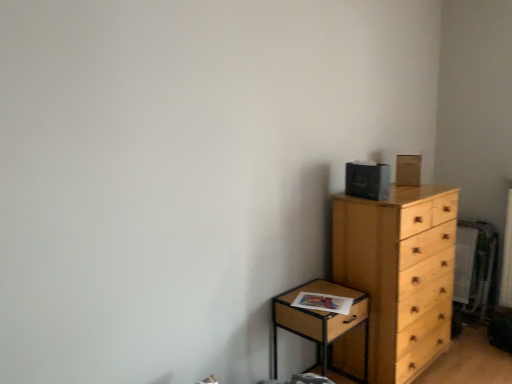
Describe the element at coordinates (399, 273) in the screenshot. This screenshot has height=384, width=512. I see `light wood chest of drawers at right` at that location.

What is the approximate width of light wood chest of drawers at right?

21.36 inches.

This screenshot has height=384, width=512. Find the location of `light wood chest of drawers at right`. light wood chest of drawers at right is located at coordinates (399, 273).

What do you see at coordinates (322, 324) in the screenshot? I see `wooden nightstand at lower right` at bounding box center [322, 324].

The height and width of the screenshot is (384, 512). I want to click on wooden nightstand at lower right, so click(322, 324).

Locate an element on the screen. The height and width of the screenshot is (384, 512). light wood chest of drawers at right is located at coordinates (399, 273).

Considering the positions of objects wooden nightstand at lower right and light wood chest of drawers at right in the image provided, who is more to the right, wooden nightstand at lower right or light wood chest of drawers at right?

Positioned to the right is light wood chest of drawers at right.

Which object is further away from the camera taking this photo, wooden nightstand at lower right or light wood chest of drawers at right?

Positioned behind is light wood chest of drawers at right.

Is point (293, 291) behind point (387, 291)?

Yes, point (293, 291) is behind point (387, 291).

From the image's perspective, does wooden nightstand at lower right appear higher than light wood chest of drawers at right?

Actually, wooden nightstand at lower right appears below light wood chest of drawers at right in the image.

From a real-world perspective, relative to light wood chest of drawers at right, is wooden nightstand at lower right vertically above or below?

In terms of real-world spatial position, wooden nightstand at lower right is below light wood chest of drawers at right.

Does wooden nightstand at lower right have a lesser width compared to light wood chest of drawers at right?

Yes.

Based on the photo, in terms of height, does wooden nightstand at lower right look taller or shorter compared to light wood chest of drawers at right?

→ Clearly, wooden nightstand at lower right is shorter compared to light wood chest of drawers at right.

Looking at the image, does wooden nightstand at lower right seem bigger or smaller compared to light wood chest of drawers at right?

Considering their sizes, wooden nightstand at lower right takes up less space than light wood chest of drawers at right.

Is light wood chest of drawers at right inside wooden nightstand at lower right?

Definitely not — light wood chest of drawers at right is not inside wooden nightstand at lower right.

Is wooden nightstand at lower right directly adjacent to light wood chest of drawers at right?

No, wooden nightstand at lower right is not making contact with light wood chest of drawers at right.

Is wooden nightstand at lower right oriented away from light wood chest of drawers at right?

No, wooden nightstand at lower right's orientation is not away from light wood chest of drawers at right.

Looking at this image, how different are the orientations of wooden nightstand at lower right and light wood chest of drawers at right in degrees?

The angular difference between wooden nightstand at lower right and light wood chest of drawers at right is 0.000534 degrees.

Image resolution: width=512 pixels, height=384 pixels. I want to click on chest of drawers behind the wooden nightstand at lower right, so click(399, 273).

Which object is positioned more to the left, light wood chest of drawers at right or wooden nightstand at lower right?

wooden nightstand at lower right is more to the left.

Which object is closer to the camera, light wood chest of drawers at right or wooden nightstand at lower right?

wooden nightstand at lower right is closer to the camera.

Which point is more distant from viewer, (x=419, y=315) or (x=317, y=334)?

Positioned behind is point (x=419, y=315).

From the image's perspective, which is below, light wood chest of drawers at right or wooden nightstand at lower right?

wooden nightstand at lower right appears lower in the image.

From a real-world perspective, which object stands above the other?

light wood chest of drawers at right, from a real-world perspective.

Is light wood chest of drawers at right thinner than wooden nightstand at lower right?

Incorrect, the width of light wood chest of drawers at right is not less than that of wooden nightstand at lower right.

Does light wood chest of drawers at right have a greater height compared to wooden nightstand at lower right?

Yes.

Between light wood chest of drawers at right and wooden nightstand at lower right, which one has larger size?

light wood chest of drawers at right.

Would you say light wood chest of drawers at right is outside wooden nightstand at lower right?

Yes.

Is there a large distance between light wood chest of drawers at right and wooden nightstand at lower right?

No, light wood chest of drawers at right is not far away from wooden nightstand at lower right.

Is light wood chest of drawers at right facing towards wooden nightstand at lower right?

No, light wood chest of drawers at right does not turn towards wooden nightstand at lower right.

How different are the orientations of light wood chest of drawers at right and wooden nightstand at lower right in degrees?

0.000534 degrees separate the facing orientations of light wood chest of drawers at right and wooden nightstand at lower right.

In order to click on the chest of drawers above the wooden nightstand at lower right (from the image's perspective) in this screenshot , I will do `click(399, 273)`.

Image resolution: width=512 pixels, height=384 pixels. Find the location of `the chest of drawers above the wooden nightstand at lower right (from the image's perspective)`. the chest of drawers above the wooden nightstand at lower right (from the image's perspective) is located at coordinates (399, 273).

Where is `nightstand in front of the light wood chest of drawers at right`? This screenshot has height=384, width=512. nightstand in front of the light wood chest of drawers at right is located at coordinates tap(322, 324).